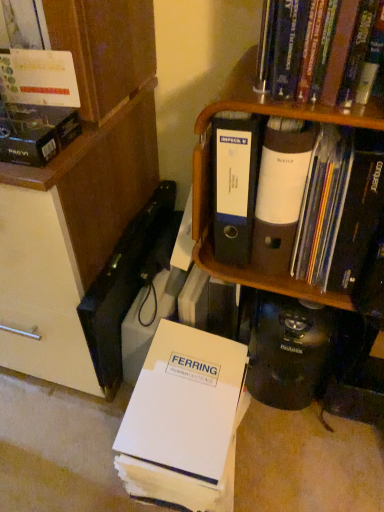
Image resolution: width=384 pixels, height=512 pixels. I want to click on free point above white paper folder at lower center, positioned as the first book in bottom-to-top order (from a real-world perspective), so click(x=182, y=358).